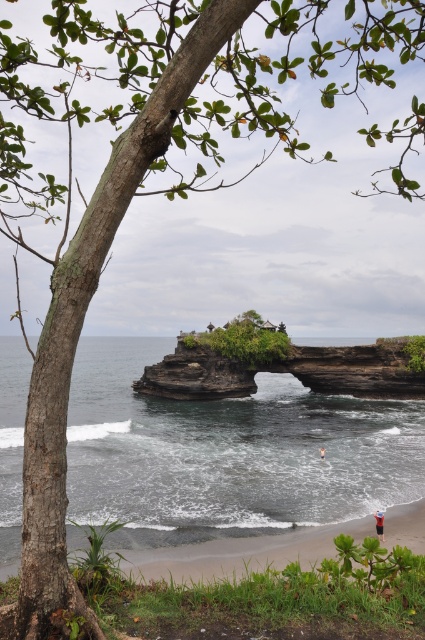
Question: Does dark gray water at center have a greater width compared to dark brown stone arch at center?

Choices:
 (A) no
 (B) yes

Answer: (B)

Question: Which point is farther from the camera taking this photo?

Choices:
 (A) (405, 448)
 (B) (153, 384)

Answer: (B)

Question: Considering the relative positions of dark gray water at center and dark brown stone arch at center in the image provided, where is dark gray water at center located with respect to dark brown stone arch at center?

Choices:
 (A) below
 (B) above

Answer: (A)

Question: Can you confirm if dark gray water at center is wider than dark brown stone arch at center?

Choices:
 (A) yes
 (B) no

Answer: (A)